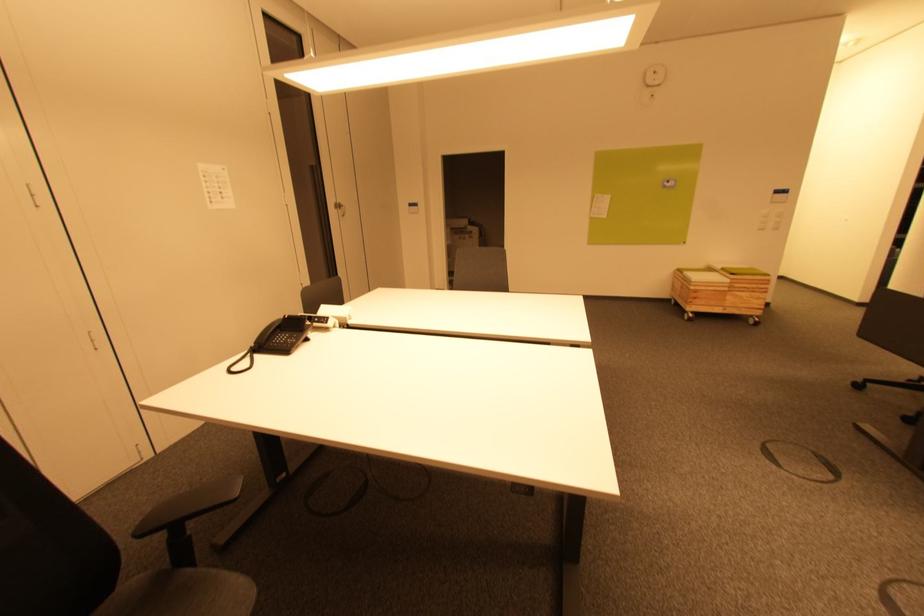
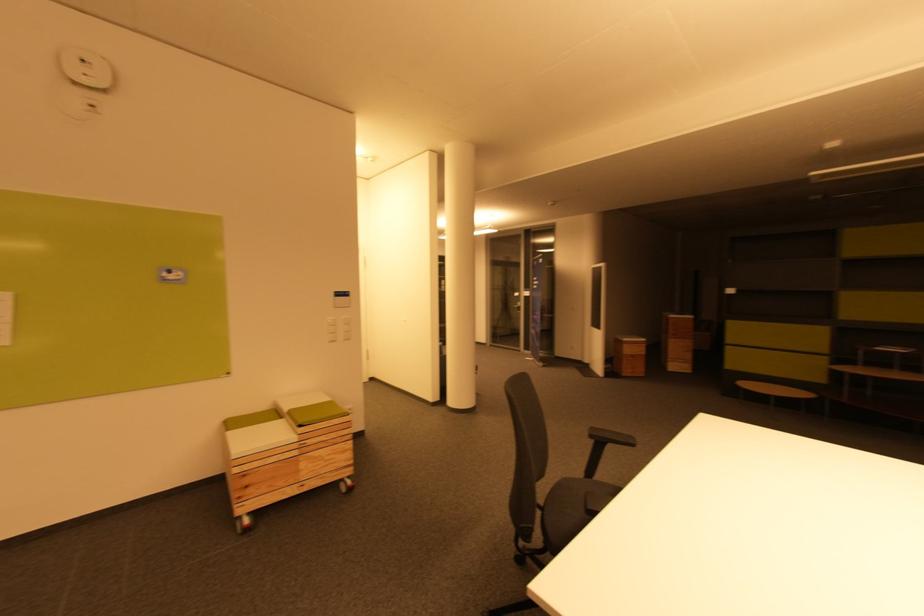
Find the pixel in the second image that matches point 712,272 in the first image.

(277, 416)